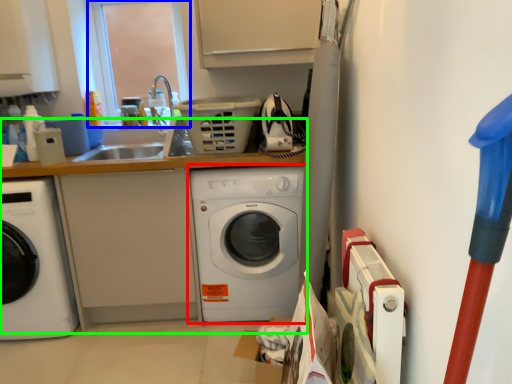
Question: Estimate the real-world distances between objects in this image. Which object is farther from washing machine (highlighted by a red box), window screen (highlighted by a blue box) or counter top (highlighted by a green box)?

Choices:
 (A) window screen
 (B) counter top

Answer: (A)